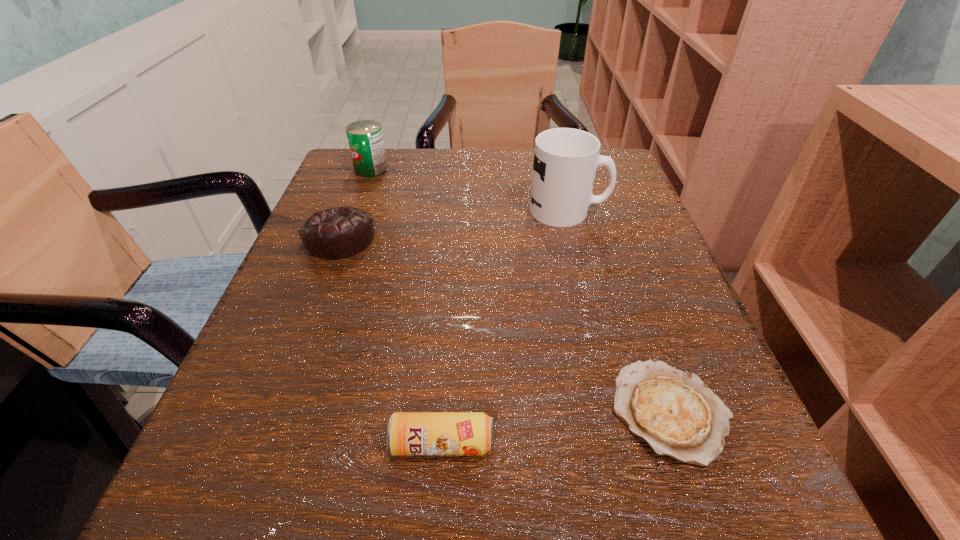
This screenshot has height=540, width=960. Identify the location of object present at the far right corner. (565, 159).

Where is `object present at the near right corner`? Image resolution: width=960 pixels, height=540 pixels. object present at the near right corner is located at coordinates (674, 412).

In the image, there is a desktop. At what (x,y) coordinates should I click in order to perform the action: click on free space at the far edge. Please return your answer as a coordinate pair (x, y). The width and height of the screenshot is (960, 540). Looking at the image, I should click on (484, 193).

You are a GUI agent. You are given a task and a screenshot of the screen. Output one action in this format:
    pyautogui.click(x=<x>, y=<y>)
    Task: Click on the vacant space at the near edge of the desktop
    
    Given the screenshot: What is the action you would take?
    coord(597,492)

The width and height of the screenshot is (960, 540). In the image, there is a desktop. What are the coordinates of `vacant area at the left edge` in the screenshot? It's located at (313, 438).

Find the location of a particular element. The width and height of the screenshot is (960, 540). free space at the right edge of the desktop is located at coordinates (651, 305).

Find the location of a particular element. This screenshot has width=960, height=540. vacant space at the far left corner of the desktop is located at coordinates (338, 167).

The image size is (960, 540). In the image, there is a desktop. What are the coordinates of `free region at the near left corner` in the screenshot? It's located at (268, 504).

Where is `vacant space at the far right corner`? vacant space at the far right corner is located at coordinates (614, 154).

This screenshot has width=960, height=540. In the image, there is a desktop. Find the location of `vacant space at the near right corner`. vacant space at the near right corner is located at coordinates (x=711, y=496).